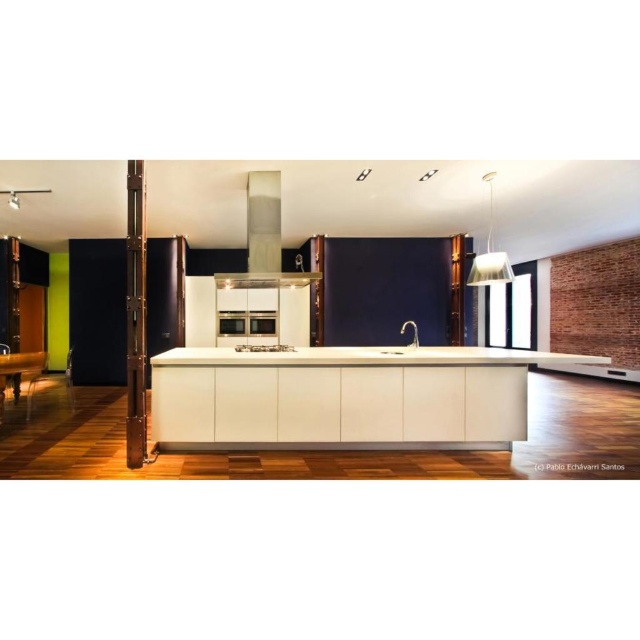
Is white glossy countertop at center above satin nickel oven at center?

No, white glossy countertop at center is not above satin nickel oven at center.

Is white glossy countertop at center to the left of satin nickel oven at center from the viewer's perspective?

In fact, white glossy countertop at center is to the right of satin nickel oven at center.

Measure the distance between point (180, 349) and camera.

A distance of 5.12 meters exists between point (180, 349) and camera.

Identify the location of white glossy countertop at center. Image resolution: width=640 pixels, height=640 pixels. (368, 356).

Does white glossy counter top at center have a smaller size compared to satin silver exhaust hood at upper center?

No.

Between point (150, 428) and point (262, 268), which one is positioned in front?

Point (150, 428)

Is point (518, 394) closer to viewer compared to point (252, 189)?

Yes, point (518, 394) is closer to viewer.

What are the coordinates of `white glossy counter top at center` in the screenshot? It's located at (x=342, y=397).

Does white glossy counter top at center come behind satin nickel oven at center?

No, it is in front of satin nickel oven at center.

Can you confirm if white glossy counter top at center is positioned above satin nickel oven at center?

No, white glossy counter top at center is not above satin nickel oven at center.

Which is behind, point (474, 412) or point (236, 323)?

Point (236, 323)

Identify the location of white glossy counter top at center. (342, 397).